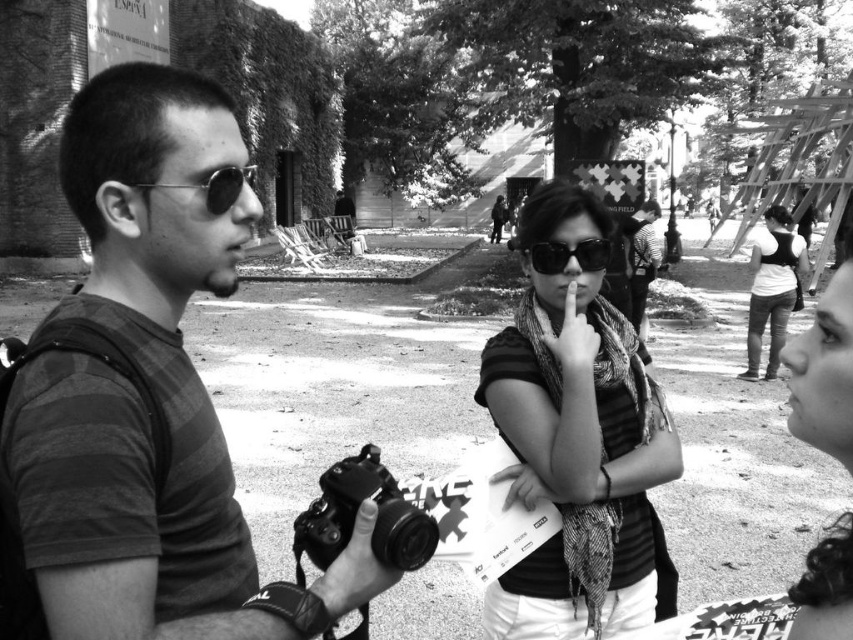
You are a GUI agent. You are given a task and a screenshot of the screen. Output one action in this format:
    pyautogui.click(x=<x>, y=<y>)
    Task: Click on the striped fabric scarf at center
    
    Given the screenshot: What is the action you would take?
    pyautogui.click(x=578, y=442)

Can you confirm if striped fabric scarf at center is bigger than white matte shirt at right?

No, striped fabric scarf at center is not bigger than white matte shirt at right.

Is point (653, 400) positioned in front of point (772, 355)?

Yes.

Where is `striped fabric scarf at center`? The width and height of the screenshot is (853, 640). striped fabric scarf at center is located at coordinates (578, 442).

In the scene shown: Measure the distance between point (602, 262) and camera.

Point (602, 262) is 2.41 meters away from camera.

Which is above, matte black sunglasses at center or metallic round sunglasses at left?

metallic round sunglasses at left

Does point (590, 248) lie in front of point (219, 189)?

That is False.

Identify the location of matte black sunglasses at center. (567, 256).

Can you confirm if matte black camera at center is positioned to the right of white matte shirt at right?

No, matte black camera at center is not to the right of white matte shirt at right.

Between matte black camera at center and white matte shirt at right, which one is positioned higher?

white matte shirt at right

Which is in front, point (341, 525) or point (767, 307)?

Positioned in front is point (341, 525).

The height and width of the screenshot is (640, 853). What are the coordinates of `matte black camera at center` in the screenshot? It's located at (355, 515).